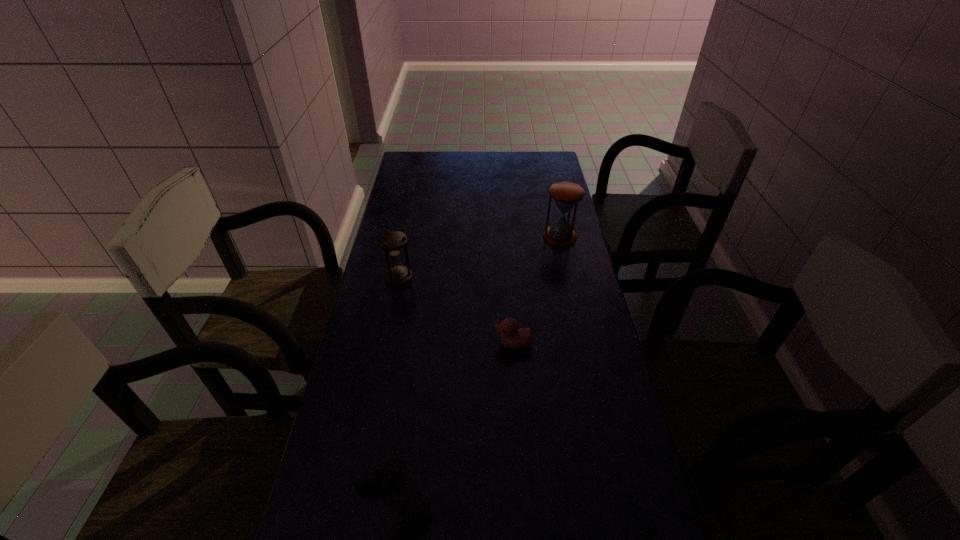
The image size is (960, 540). What are the coordinates of `free region located on the front-facing side of the third farthest object` in the screenshot? It's located at (459, 344).

This screenshot has height=540, width=960. In order to click on object that is at the left edge in this screenshot , I will do `click(392, 242)`.

Identify the location of object located in the right edge section of the desktop. (566, 195).

Find the location of a particular element. The image size is (960, 540). vacant space at the far edge of the desktop is located at coordinates (504, 163).

Find the location of a particular element. This screenshot has width=960, height=540. vacant space at the left edge of the desktop is located at coordinates (342, 477).

Where is `free space at the right edge of the desktop`? free space at the right edge of the desktop is located at coordinates (540, 245).

Identify the location of vacant region at the far left corner. (414, 154).

This screenshot has height=540, width=960. In the image, there is a desktop. Find the location of `vacant space at the far right corner`. vacant space at the far right corner is located at coordinates (538, 157).

I want to click on blank region between the left hourglass and the duckling, so click(x=456, y=311).

This screenshot has height=540, width=960. I want to click on free point between the right hourglass and the second farthest object, so click(x=480, y=258).